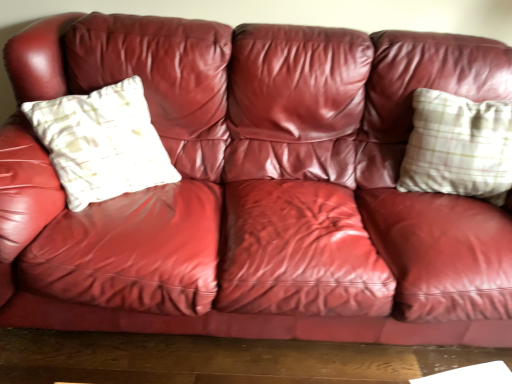
The width and height of the screenshot is (512, 384). What do you see at coordinates (458, 147) in the screenshot? I see `plaid fabric pillow at right` at bounding box center [458, 147].

The image size is (512, 384). I want to click on plaid fabric pillow at right, so click(458, 147).

The width and height of the screenshot is (512, 384). I want to click on plaid fabric pillow at right, so click(458, 147).